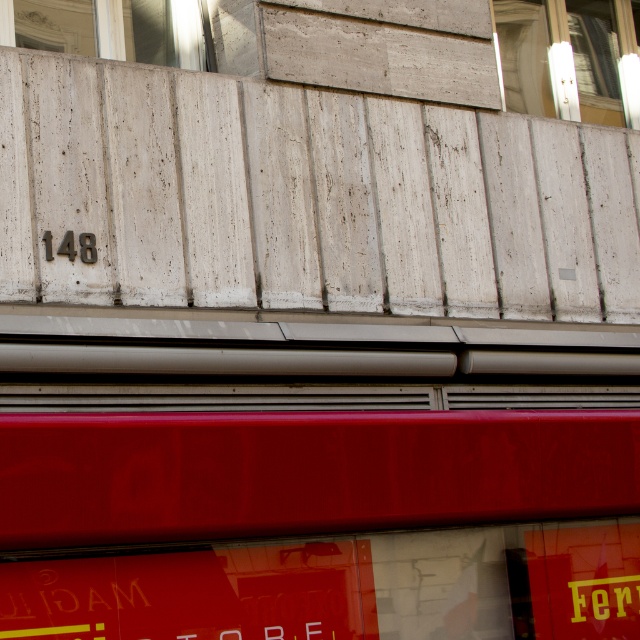
You are standing in front of the building facade. Where is the clear glass window at upper right located in terms of its 2D coordinates?

The clear glass window at upper right is located at the 2D coordinates of point (561, 58).

You are standing in front of the building facade and want to know which window is closer to you. The clear glass window at upper right and the white marble window at upper left are both visible. Which one is closer?

The clear glass window at upper right is closer to you because it is further to the viewer than the white marble window at upper left.

You are a window installer assessing the building facade. You need to replace both the clear glass window at upper right and the white marble window at upper left. Which window requires a larger replacement pane?

The clear glass window at upper right requires a larger replacement pane because it is bigger than the white marble window at upper left.